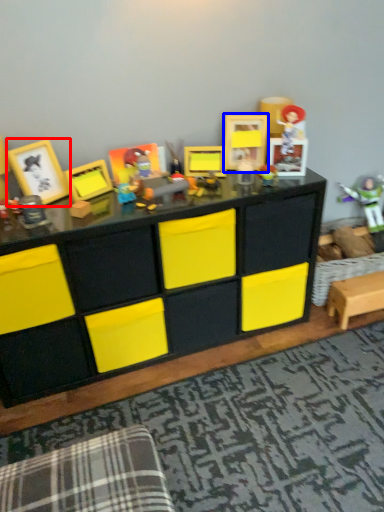
Question: Which of the following is the closest to the observer, picture frame (highlighted by a red box) or picture frame (highlighted by a blue box)?

Choices:
 (A) picture frame
 (B) picture frame

Answer: (A)